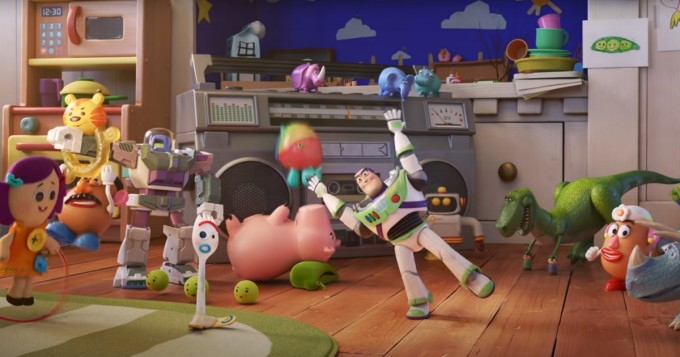
This screenshot has height=357, width=680. Identify the location of wood floor. pyautogui.click(x=564, y=334).